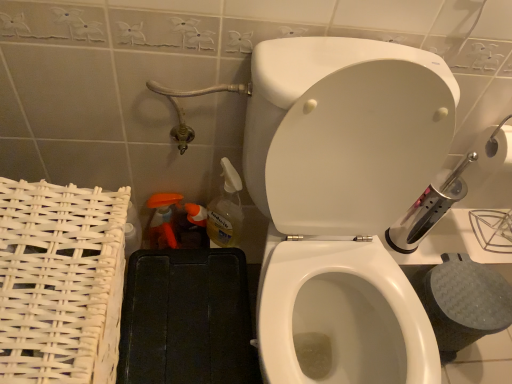
Question: Considering the positions of point click(240, 201) and point click(271, 168), is point click(240, 201) closer or farther from the camera than point click(271, 168)?

Choices:
 (A) farther
 (B) closer

Answer: (A)

Question: Considering the positions of translucent plastic spray bottle at lower center, which is the 3th cleaning product from left to right, and white glossy toilet at center in the image, is translucent plastic spray bottle at lower center, which is the 3th cleaning product from left to right, taller or shorter than white glossy toilet at center?

Choices:
 (A) short
 (B) tall

Answer: (A)

Question: Based on their relative distances, which object is nearer to the orange plastic spray bottle at lower left, the 2th cleaning product when ordered from right to left?

Choices:
 (A) white wicker basket at left
 (B) white glossy toilet at center
 (C) translucent plastic spray bottle at lower center, placed as the 1th cleaning product when sorted from right to left
 (D) translucent plastic spray bottle at lower left, which is counted as the 1th cleaning product, starting from the left

Answer: (D)

Question: Estimate the real-world distances between objects in this image. Which object is farther from the translucent plastic spray bottle at lower left, which is counted as the 3th cleaning product, starting from the right?

Choices:
 (A) white glossy toilet at center
 (B) translucent plastic spray bottle at lower center, placed as the 1th cleaning product when sorted from right to left
 (C) white wicker basket at left
 (D) orange plastic spray bottle at lower left, the 2th cleaning product when ordered from right to left

Answer: (A)